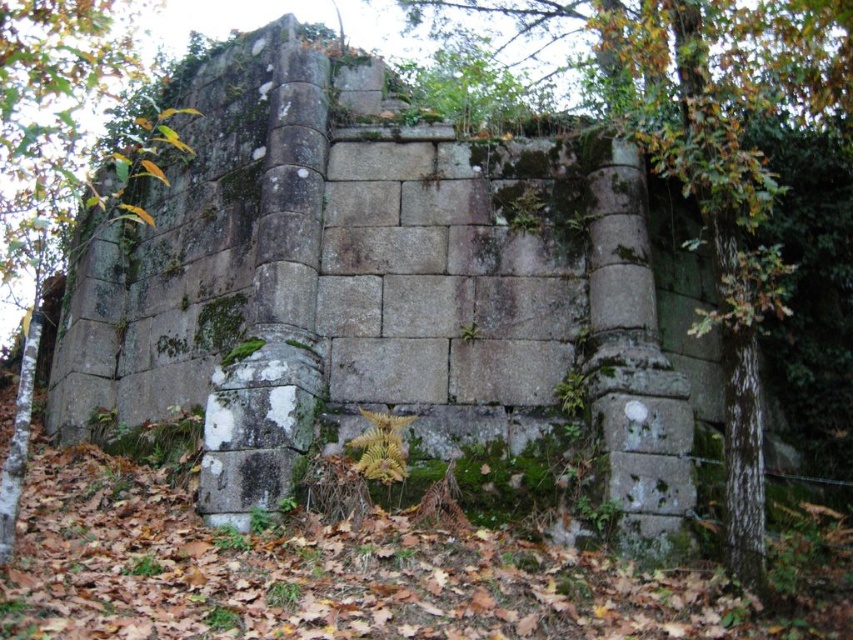
Is green mossy tree at left positioned at the back of green leafy ivy at center?

No, it is in front of green leafy ivy at center.

Is point (18, 406) less distant than point (364, 461)?

That is True.

The image size is (853, 640). I want to click on green mossy tree at left, so click(x=47, y=163).

Locate an element on the screen. green mossy tree at left is located at coordinates (47, 163).

Is green mossy stone pillar at center shorter than green mossy tree at left?

No.

Who is lower down, green mossy stone pillar at center or green mossy tree at left?

green mossy tree at left is below.

Is point (654, 104) closer to viewer compared to point (74, 77)?

Yes, it is in front of point (74, 77).

Find the location of a particular element. Image resolution: width=853 pixels, height=640 pixels. green mossy stone pillar at center is located at coordinates [x=712, y=168].

Is green mossy stone pillar at center shorter than green leafy ivy at center?

Incorrect, green mossy stone pillar at center's height does not fall short of green leafy ivy at center's.

Does green mossy stone pillar at center have a larger size compared to green leafy ivy at center?

Correct, green mossy stone pillar at center is larger in size than green leafy ivy at center.

Does point (741, 205) come behind point (405, 448)?

That is False.

Locate an element on the screen. green mossy stone pillar at center is located at coordinates [x=712, y=168].